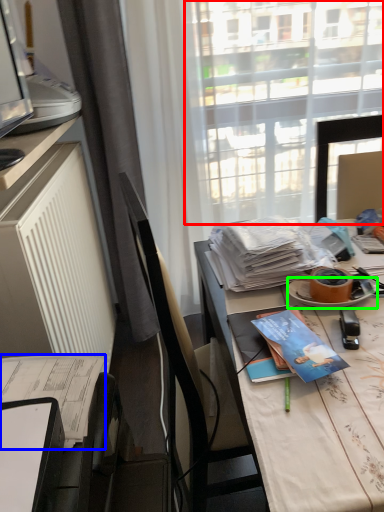
Question: Which object is the closest to the window screen (highlighted by a red box)? Choose among these: journal (highlighted by a blue box) or plate (highlighted by a green box).

Choices:
 (A) journal
 (B) plate

Answer: (B)